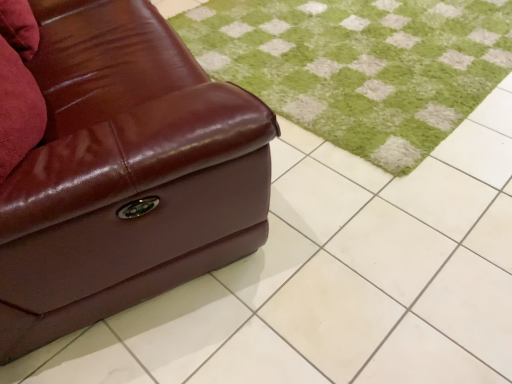
Question: Would you consider brown leather couch at left to be distant from green soft rug at center?

Choices:
 (A) yes
 (B) no

Answer: (B)

Question: Does brown leather couch at left touch green soft rug at center?

Choices:
 (A) no
 (B) yes

Answer: (A)

Question: From the image's perspective, is brown leather couch at left over green soft rug at center?

Choices:
 (A) yes
 (B) no

Answer: (B)

Question: Is green soft rug at center a part of brown leather couch at left?

Choices:
 (A) yes
 (B) no

Answer: (B)

Question: Does brown leather couch at left appear on the left side of green soft rug at center?

Choices:
 (A) yes
 (B) no

Answer: (A)

Question: From the image's perspective, is brown leather couch at left below green soft rug at center?

Choices:
 (A) yes
 (B) no

Answer: (A)

Question: From a real-world perspective, is green soft rug at center located higher than brown leather couch at left?

Choices:
 (A) no
 (B) yes

Answer: (A)

Question: Is green soft rug at center closer to camera compared to brown leather couch at left?

Choices:
 (A) yes
 (B) no

Answer: (B)

Question: Can you confirm if green soft rug at center is taller than brown leather couch at left?

Choices:
 (A) no
 (B) yes

Answer: (A)

Question: Can you confirm if green soft rug at center is shorter than brown leather couch at left?

Choices:
 (A) no
 (B) yes

Answer: (B)

Question: Could you tell me if green soft rug at center is turned towards brown leather couch at left?

Choices:
 (A) yes
 (B) no

Answer: (B)

Question: Could brown leather couch at left be considered to be inside green soft rug at center?

Choices:
 (A) no
 (B) yes

Answer: (A)

Question: From the image's perspective, relative to green soft rug at center, is brown leather couch at left above or below?

Choices:
 (A) below
 (B) above

Answer: (A)